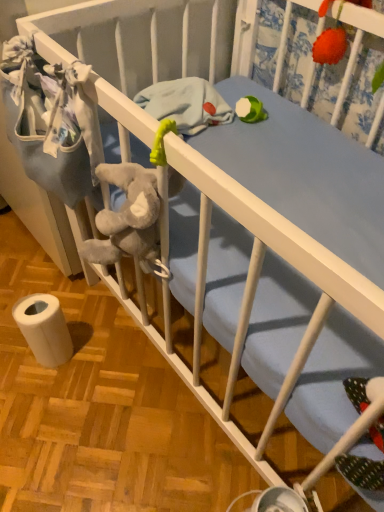
Image resolution: width=384 pixels, height=512 pixels. Describe the element at coordinates (44, 329) in the screenshot. I see `white matte toilet paper at lower left` at that location.

What are the coordinates of `white matte toilet paper at lower left` in the screenshot? It's located at (44, 329).

Measure the distance between white matte toilet paper at lower left and camera.

white matte toilet paper at lower left and camera are 3.42 feet apart from each other.

From the picture: What is the approximate height of white matte toilet paper at lower left?

It is 9.09 inches.

At what (x,y) coordinates should I click in order to perform the action: click on white matte toilet paper at lower left. Please return your answer as a coordinate pair (x, y). The height and width of the screenshot is (512, 384). Looking at the image, I should click on (44, 329).